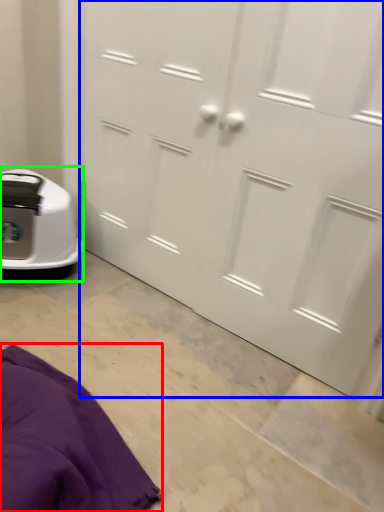
Question: Based on their relative distances, which object is farther from blanket (highlighted by a red box)? Choose from door (highlighted by a blue box) and home appliance (highlighted by a green box).

Choices:
 (A) door
 (B) home appliance

Answer: (A)